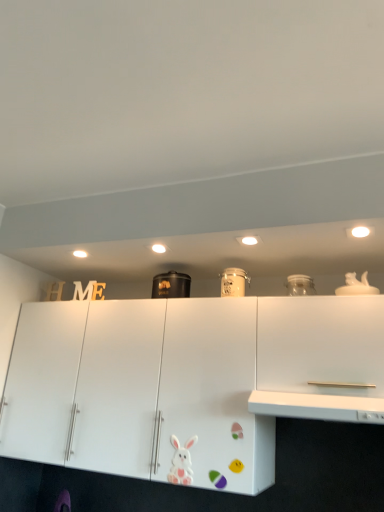
Question: Is white matte cabinet at right surrounded by white matte rabbit at lower center?

Choices:
 (A) yes
 (B) no

Answer: (B)

Question: Is white matte rabbit at lower center facing away from white matte cabinet at right?

Choices:
 (A) yes
 (B) no

Answer: (B)

Question: Considering the relative sizes of white matte rabbit at lower center and white matte cabinet at right in the image provided, is white matte rabbit at lower center smaller than white matte cabinet at right?

Choices:
 (A) no
 (B) yes

Answer: (B)

Question: Is white matte rabbit at lower center facing towards white matte cabinet at right?

Choices:
 (A) no
 (B) yes

Answer: (A)

Question: Can you confirm if white matte rabbit at lower center is wider than white matte cabinet at right?

Choices:
 (A) yes
 (B) no

Answer: (B)

Question: From a real-world perspective, is matte white jar at center, which is the 2th appliance in left-to-right order, above or below white glossy counter top at center?

Choices:
 (A) above
 (B) below

Answer: (A)

Question: In the image, is matte white jar at center, positioned as the second appliance in back-to-front order, on the left side or the right side of white glossy counter top at center?

Choices:
 (A) left
 (B) right

Answer: (A)

Question: In terms of width, does matte white jar at center, placed as the first appliance when sorted from front to back, look wider or thinner when compared to white glossy counter top at center?

Choices:
 (A) wide
 (B) thin

Answer: (B)

Question: Considering the positions of matte white jar at center, which is the 2th appliance in left-to-right order, and white glossy counter top at center in the image, is matte white jar at center, which is the 2th appliance in left-to-right order, taller or shorter than white glossy counter top at center?

Choices:
 (A) short
 (B) tall

Answer: (B)

Question: In the image, is black matte container at center, marked as the first appliance in a back-to-front arrangement, on the left side or the right side of white glossy counter top at center?

Choices:
 (A) left
 (B) right

Answer: (A)

Question: In terms of height, does black matte container at center, which is the 1th appliance in left-to-right order, look taller or shorter compared to white glossy counter top at center?

Choices:
 (A) tall
 (B) short

Answer: (A)

Question: Based on their sizes in the image, would you say black matte container at center, which is the second appliance in right-to-left order, is bigger or smaller than white glossy counter top at center?

Choices:
 (A) small
 (B) big

Answer: (A)

Question: Relative to white glossy counter top at center, is black matte container at center, marked as the first appliance in a back-to-front arrangement, in front or behind?

Choices:
 (A) front
 (B) behind

Answer: (B)

Question: In the image, is matte white jar at center, positioned as the second appliance in back-to-front order, on the left side or the right side of black matte container at center, which is the second appliance in right-to-left order?

Choices:
 (A) right
 (B) left

Answer: (A)

Question: From the image's perspective, is matte white jar at center, placed as the first appliance when sorted from front to back, positioned above or below black matte container at center, marked as the first appliance in a back-to-front arrangement?

Choices:
 (A) below
 (B) above

Answer: (B)